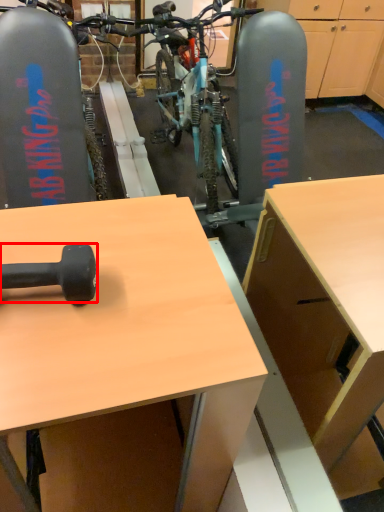
Question: Where is dumbbell (annotated by the red box) located in relation to desk in the image?

Choices:
 (A) right
 (B) left

Answer: (B)